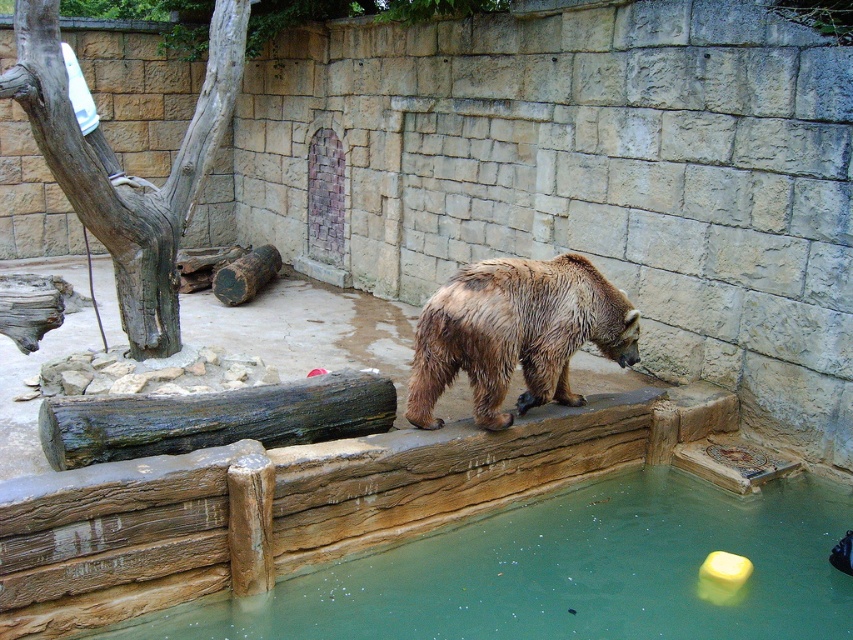
Can you confirm if greenish water at lower center is shorter than wet fur bear at center?

Correct, greenish water at lower center is not as tall as wet fur bear at center.

The image size is (853, 640). I want to click on greenish water at lower center, so click(x=569, y=572).

Does point (433, 579) lie in front of point (540, 294)?

Yes, point (433, 579) is closer to viewer.

The height and width of the screenshot is (640, 853). Find the location of `greenish water at lower center`. greenish water at lower center is located at coordinates (569, 572).

Is greenish water at lower center closer to camera compared to weathered wood log at center?

Yes.

Does greenish water at lower center have a lesser width compared to weathered wood log at center?

No, greenish water at lower center is not thinner than weathered wood log at center.

The image size is (853, 640). Describe the element at coordinates (569, 572) in the screenshot. I see `greenish water at lower center` at that location.

Find the location of `greenish water at lower center`. greenish water at lower center is located at coordinates (569, 572).

Between wet fur bear at center and weathered wood log at center, which one is positioned higher?

wet fur bear at center

Can you confirm if wet fur bear at center is wider than weathered wood log at center?

No.

Where is `wet fur bear at center`? This screenshot has width=853, height=640. wet fur bear at center is located at coordinates (515, 333).